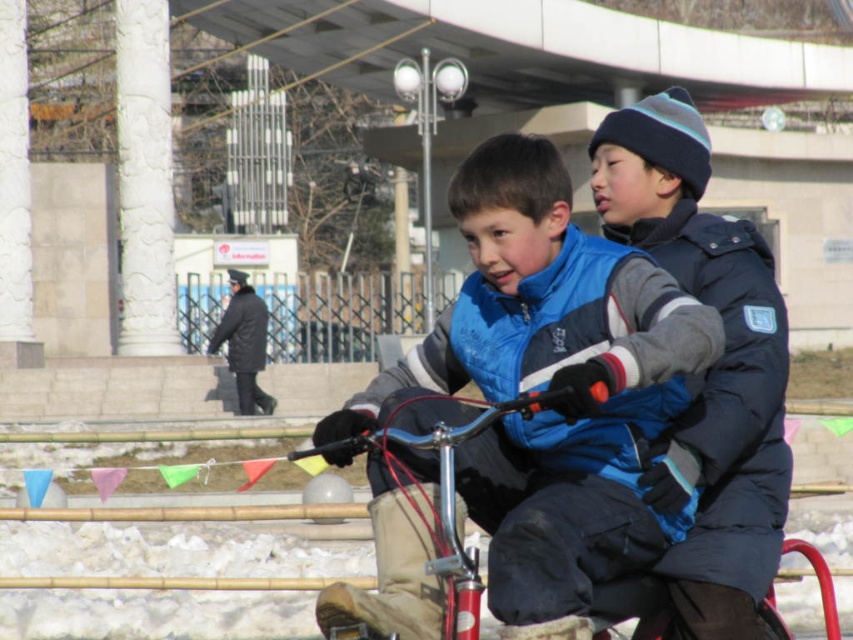
Question: Which is farther from the metallic silver bicycle at center?

Choices:
 (A) blue fleece vest at center
 (B) dark blue puffy jacket at center
 (C) white textured column at left

Answer: (C)

Question: Which of the following is the farthest from the observer?

Choices:
 (A) blue fleece vest at center
 (B) metallic silver bicycle at center
 (C) dark blue puffy jacket at center
 (D) white textured column at upper left

Answer: (D)

Question: Can you confirm if metallic silver bicycle at center is positioned above white textured column at left?

Choices:
 (A) yes
 (B) no

Answer: (B)

Question: Which of these objects is positioned farthest from the dark blue puffy jacket at center?

Choices:
 (A) blue fleece vest at center
 (B) white textured column at upper left
 (C) metallic silver bicycle at center
 (D) white textured column at left

Answer: (B)

Question: Can you confirm if blue fleece vest at center is positioned to the right of white textured column at left?

Choices:
 (A) yes
 (B) no

Answer: (A)

Question: In this image, where is blue fleece vest at center located relative to dark blue puffy jacket at center?

Choices:
 (A) left
 (B) right

Answer: (A)